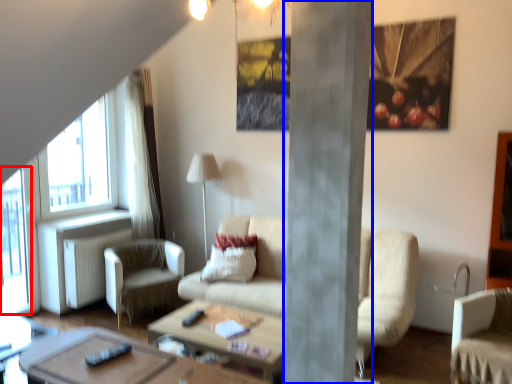
Question: Which of the following is the farthest to the observer, window screen (highlighted by a red box) or pillar (highlighted by a blue box)?

Choices:
 (A) window screen
 (B) pillar

Answer: (A)